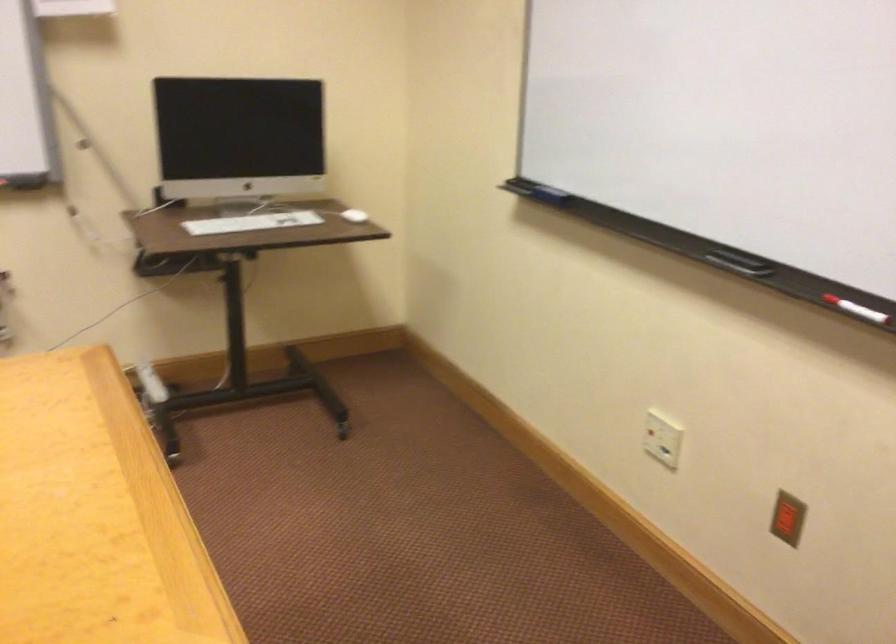
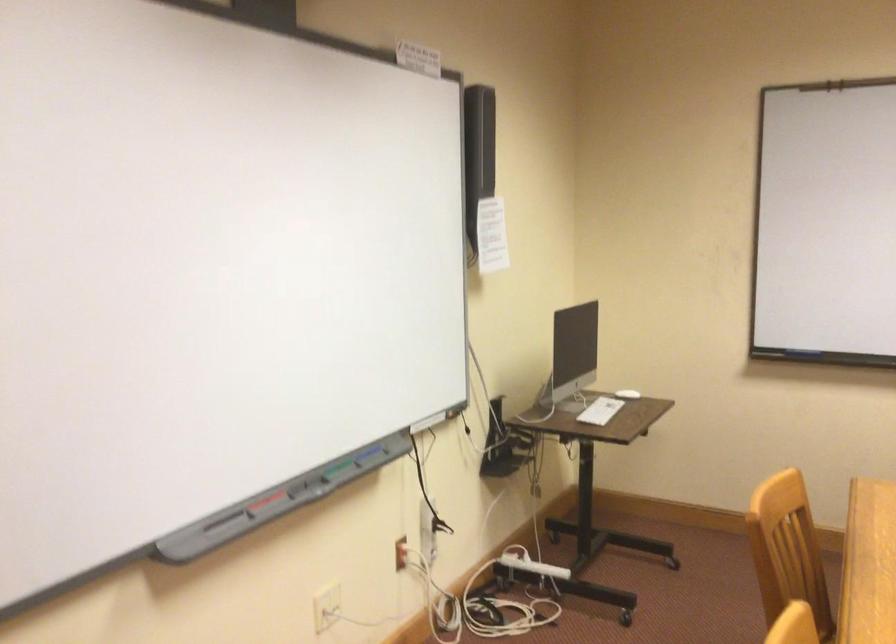
In the second image, find the point that corresponds to point 325,214 in the first image.

(627, 393)